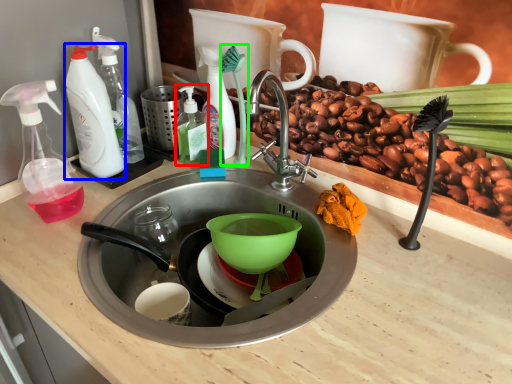
Question: Which is farther away from bottle (highlighted by a red box)? cleaning product (highlighted by a blue box) or brush (highlighted by a green box)?

Choices:
 (A) cleaning product
 (B) brush

Answer: (A)